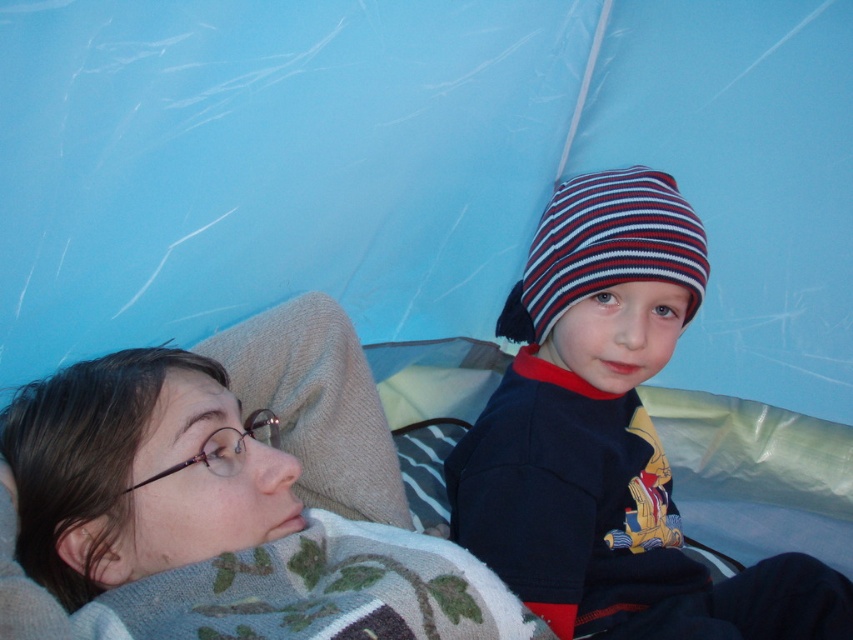
Question: Is striped knit hat at upper right positioned in front of striped knit beanie at center?

Choices:
 (A) no
 (B) yes

Answer: (B)

Question: Estimate the real-world distances between objects in this image. Which object is farther from the blue fabric tent at upper center?

Choices:
 (A) striped knit beanie at center
 (B) striped knit hat at upper right

Answer: (B)

Question: Which of the following is the closest to the observer?

Choices:
 (A) striped knit hat at upper right
 (B) striped knit beanie at center

Answer: (A)

Question: In this image, where is blue fabric tent at upper center located relative to striped knit beanie at center?

Choices:
 (A) left
 (B) right

Answer: (A)

Question: Can you confirm if blue fabric tent at upper center is bigger than striped knit hat at upper right?

Choices:
 (A) yes
 (B) no

Answer: (A)

Question: Which point is closer to the camera taking this photo?

Choices:
 (A) tap(601, 196)
 (B) tap(401, 280)
 (C) tap(531, 605)

Answer: (C)